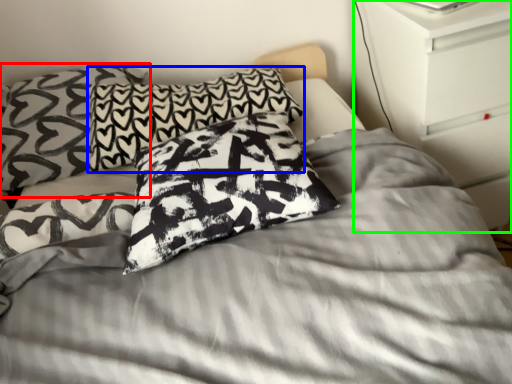
Question: Which object is the farthest from pillow (highlighted by a red box)? Choose among these: pillow (highlighted by a blue box) or dresser (highlighted by a green box).

Choices:
 (A) pillow
 (B) dresser

Answer: (B)